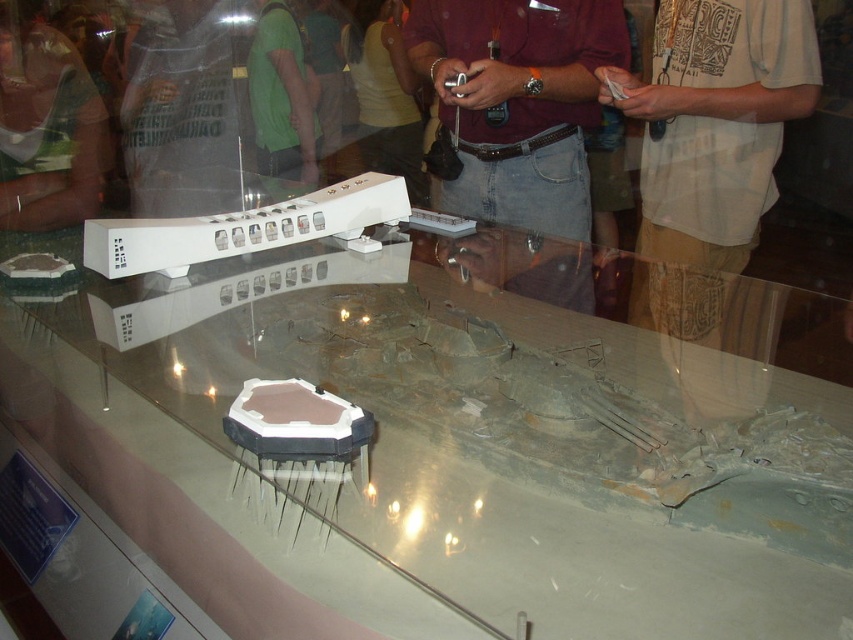
Can you confirm if transparent glass table at center is shorter than maroon shirt at center?

Yes.

Can you confirm if transparent glass table at center is bigger than maroon shirt at center?

Yes.

This screenshot has height=640, width=853. Find the location of `transparent glass table at center`. transparent glass table at center is located at coordinates (445, 448).

In order to click on transparent glass table at center in this screenshot , I will do `click(445, 448)`.